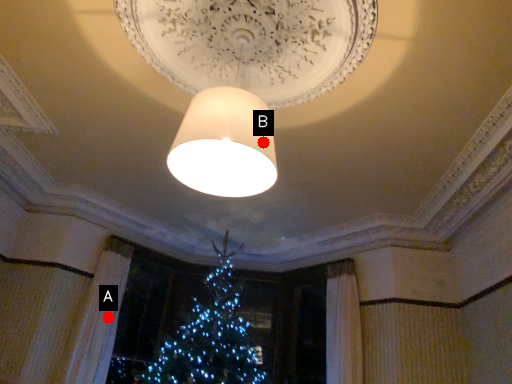
Question: Two points are circled on the image, labeled by A and B beside each circle. Which point is farther from the camera taking this photo?

Choices:
 (A) A is further
 (B) B is further

Answer: (A)